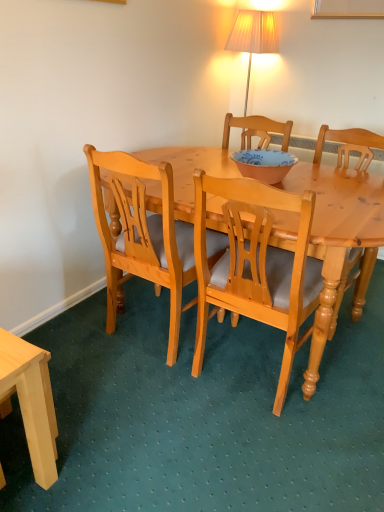
What do you see at coordinates (142, 234) in the screenshot? This screenshot has height=512, width=384. I see `light brown wood chair at center, acting as the third chair starting from the right` at bounding box center [142, 234].

What is the approximate width of light wood desk at lower left?

light wood desk at lower left is 12.10 inches in width.

Measure the distance between light wood chair at center, which is counted as the 3th chair, starting from the left, and camera.

1.93 meters.

Find the location of `light brown wood chair at center, acting as the third chair starting from the right`. light brown wood chair at center, acting as the third chair starting from the right is located at coordinates (142, 234).

Consider the image. Which point is more distant from viewer, (264, 173) or (291, 270)?

Point (264, 173)

Is matte pink bowl at center looking in the opposite direction of light wood chair at center, which is counted as the second chair, starting from the left?

No, light wood chair at center, which is counted as the second chair, starting from the left, is not at the back of matte pink bowl at center.

From the image's perspective, is matte pink bowl at center beneath light wood chair at center, which is counted as the second chair, starting from the left?

No, from the image's perspective, matte pink bowl at center is not beneath light wood chair at center, which is counted as the second chair, starting from the left.

Based on the photo, from a real-world perspective, is matte pink bowl at center above or below light wood chair at center, the second chair in the right-to-left sequence?

matte pink bowl at center is situated higher than light wood chair at center, the second chair in the right-to-left sequence, in the real world.

From the light wood desk at lower left, count 1st chair to the right and point to it. Please provide its 2D coordinates.

[(142, 234)]

Which of these two, light brown wood chair at center, the first chair from the left, or light wood desk at lower left, is wider?

Wider between the two is light brown wood chair at center, the first chair from the left.

What's the angular difference between light brown wood chair at center, acting as the third chair starting from the right, and light wood desk at lower left's facing directions?

The angle between the facing direction of light brown wood chair at center, acting as the third chair starting from the right, and the facing direction of light wood desk at lower left is 87.1 degrees.

From a real-world perspective, between light brown wood chair at center, the first chair from the left, and light wood desk at lower left, who is vertically higher?

light brown wood chair at center, the first chair from the left.

Between point (31, 345) and point (370, 256), which one is positioned behind?

The point (370, 256) is behind.

How many degrees apart are the facing directions of light wood desk at lower left and light wood chair at center, which is counted as the 3th chair, starting from the left?

92.9 degrees separate the facing orientations of light wood desk at lower left and light wood chair at center, which is counted as the 3th chair, starting from the left.

From a real-world perspective, which is physically above, light wood desk at lower left or light wood chair at center, which is counted as the 3th chair, starting from the left?

In real-world perspective, light wood chair at center, which is counted as the 3th chair, starting from the left, is above.

Identify the location of desk lying in front of the light wood chair at center, which is counted as the 3th chair, starting from the left. The width and height of the screenshot is (384, 512). (31, 401).

Is light wood chair at center, which is counted as the 3th chair, starting from the left, to the left of matte pink bowl at center from the viewer's perspective?

No, light wood chair at center, which is counted as the 3th chair, starting from the left, is not to the left of matte pink bowl at center.

The height and width of the screenshot is (512, 384). I want to click on bowl lying behind the light wood chair at center, which is counted as the 3th chair, starting from the left, so click(264, 164).

Consider the image. Considering the sizes of objects light wood chair at center, which is counted as the 3th chair, starting from the left, and matte pink bowl at center in the image provided, who is shorter, light wood chair at center, which is counted as the 3th chair, starting from the left, or matte pink bowl at center?

With less height is matte pink bowl at center.

From the image's perspective, which is below, light wood chair at center, which is counted as the 3th chair, starting from the left, or matte pink bowl at center?

light wood chair at center, which is counted as the 3th chair, starting from the left, appears lower in the image.

Is matte pink bowl at center not near light wood desk at lower left?

matte pink bowl at center is far away from light wood desk at lower left.

From a real-world perspective, is matte pink bowl at center located beneath light wood desk at lower left?

No.

Looking at the image, does matte pink bowl at center seem bigger or smaller compared to light wood desk at lower left?

Considering their sizes, matte pink bowl at center takes up less space than light wood desk at lower left.

Identify the location of bowl on the right side of light wood desk at lower left. (264, 164).

Which of these two, matte pink bowl at center or light brown wood chair at center, the first chair from the left, is bigger?

Bigger between the two is light brown wood chair at center, the first chair from the left.

Does point (273, 175) come in front of point (132, 194)?

No, it is behind (132, 194).

Would you say matte pink bowl at center is inside or outside light brown wood chair at center, the first chair from the left?

matte pink bowl at center is outside light brown wood chair at center, the first chair from the left.

Is matte pink bowl at center in front of light brown wood chair at center, acting as the third chair starting from the right?

No, it is behind light brown wood chair at center, acting as the third chair starting from the right.

Is point (51, 407) positioned in front of point (247, 244)?

That is True.

Can you confirm if light wood desk at lower left is thinner than light wood chair at center, the second chair in the right-to-left sequence?

Yes, light wood desk at lower left is thinner than light wood chair at center, the second chair in the right-to-left sequence.

The width and height of the screenshot is (384, 512). I want to click on the 2nd chair counting from the right side of the light wood desk at lower left, so click(x=256, y=266).

At what (x,y) coordinates should I click in order to perform the action: click on bowl positioned vertically above the light wood chair at center, which is counted as the second chair, starting from the left (from a real-world perspective). Please return your answer as a coordinate pair (x, y). Looking at the image, I should click on (264, 164).

Where is `desk below the light brown wood chair at center, acting as the third chair starting from the right (from a real-world perspective)`? Image resolution: width=384 pixels, height=512 pixels. desk below the light brown wood chair at center, acting as the third chair starting from the right (from a real-world perspective) is located at coordinates (31, 401).

Looking at the image, which one is located closer to light wood chair at center, which is counted as the second chair, starting from the left, light wood desk at lower left or light brown wood chair at center, acting as the third chair starting from the right?

The object closer to light wood chair at center, which is counted as the second chair, starting from the left, is light brown wood chair at center, acting as the third chair starting from the right.

Looking at the image, which one is located further to matte pink bowl at center, light wood chair at center, which is the 1th chair from right to left, or light wood desk at lower left?

light wood desk at lower left.

Based on their spatial positions, is light wood chair at center, which is the 1th chair from right to left, or light brown wood chair at center, acting as the third chair starting from the right, closer to matte pink bowl at center?

Among the two, light wood chair at center, which is the 1th chair from right to left, is located nearer to matte pink bowl at center.

When comparing their distances from light brown wood chair at center, the first chair from the left, does light wood chair at center, which is counted as the 3th chair, starting from the left, or matte pink bowl at center seem closer?

Based on the image, matte pink bowl at center appears to be nearer to light brown wood chair at center, the first chair from the left.

When comparing their distances from light wood chair at center, which is counted as the second chair, starting from the left, does light wood chair at center, which is counted as the 3th chair, starting from the left, or matte pink bowl at center seem closer?

Based on the image, matte pink bowl at center appears to be nearer to light wood chair at center, which is counted as the second chair, starting from the left.

Considering their positions, is light wood chair at center, which is counted as the second chair, starting from the left, positioned further to matte pink bowl at center than light wood desk at lower left?

light wood desk at lower left.

Based on their spatial positions, is matte pink bowl at center or light wood chair at center, which is the 1th chair from right to left, further from light brown wood chair at center, the first chair from the left?

Based on the image, light wood chair at center, which is the 1th chair from right to left, appears to be further to light brown wood chair at center, the first chair from the left.

Considering their positions, is light brown wood chair at center, acting as the third chair starting from the right, positioned closer to light wood chair at center, the second chair in the right-to-left sequence, than light wood chair at center, which is the 1th chair from right to left?

light brown wood chair at center, acting as the third chair starting from the right.

Find the location of a particular element. The width and height of the screenshot is (384, 512). bowl between light brown wood chair at center, acting as the third chair starting from the right, and light wood chair at center, which is the 1th chair from right to left, from left to right is located at coordinates (264, 164).

At what (x,y) coordinates should I click in order to perform the action: click on chair located between light wood desk at lower left and light wood chair at center, the second chair in the right-to-left sequence, in the left-right direction. Please return your answer as a coordinate pair (x, y). This screenshot has width=384, height=512. Looking at the image, I should click on click(x=142, y=234).

Image resolution: width=384 pixels, height=512 pixels. What are the coordinates of `chair situated between light brown wood chair at center, acting as the third chair starting from the right, and light wood chair at center, which is the 1th chair from right to left, from left to right` in the screenshot? It's located at tap(256, 266).

At what (x,y) coordinates should I click in order to perform the action: click on bowl located between light wood desk at lower left and light wood chair at center, which is the 1th chair from right to left, in the left-right direction. Please return your answer as a coordinate pair (x, y). Looking at the image, I should click on (264, 164).